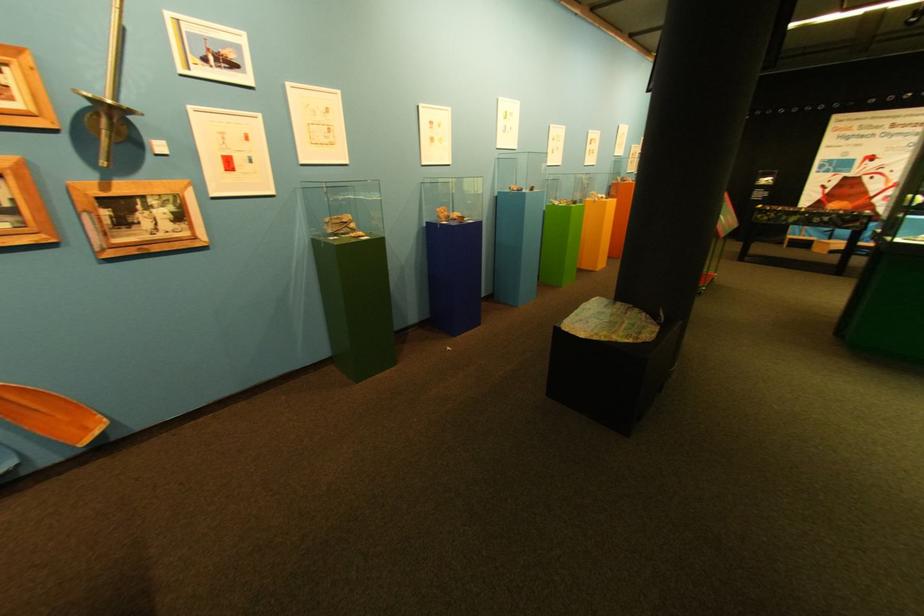
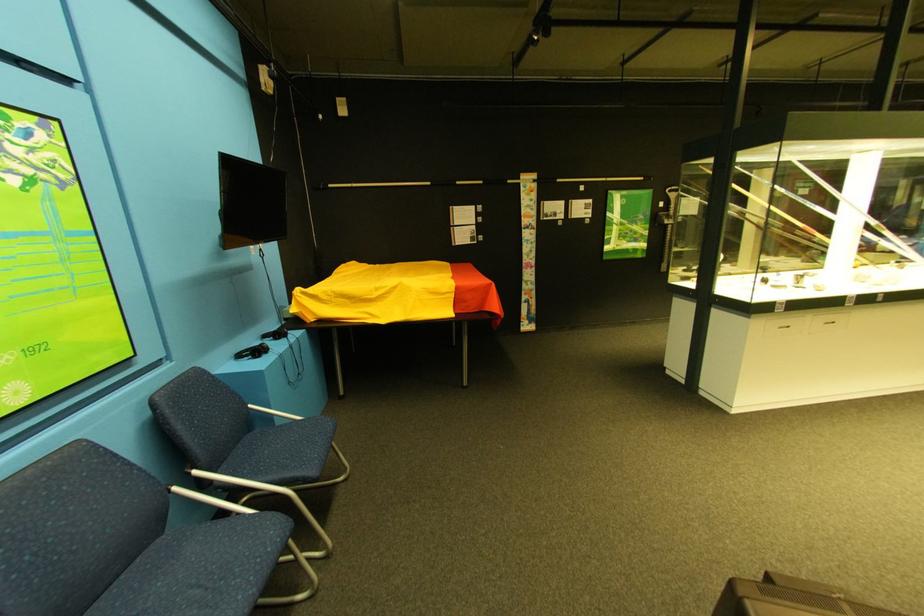
Question: I am providing you with two images of the same scene from different viewpoints. Please identify which objects are invisible in image2.

Choices:
 (A) blue climbing hold
 (B) black headphones
 (C) wooden oar blade
 (D) blue chair sitting surface

Answer: (C)